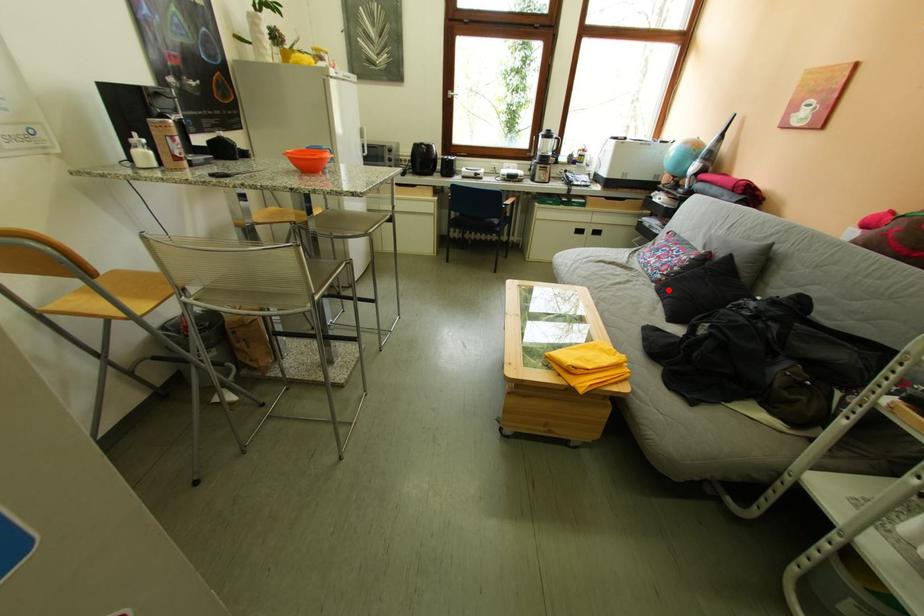
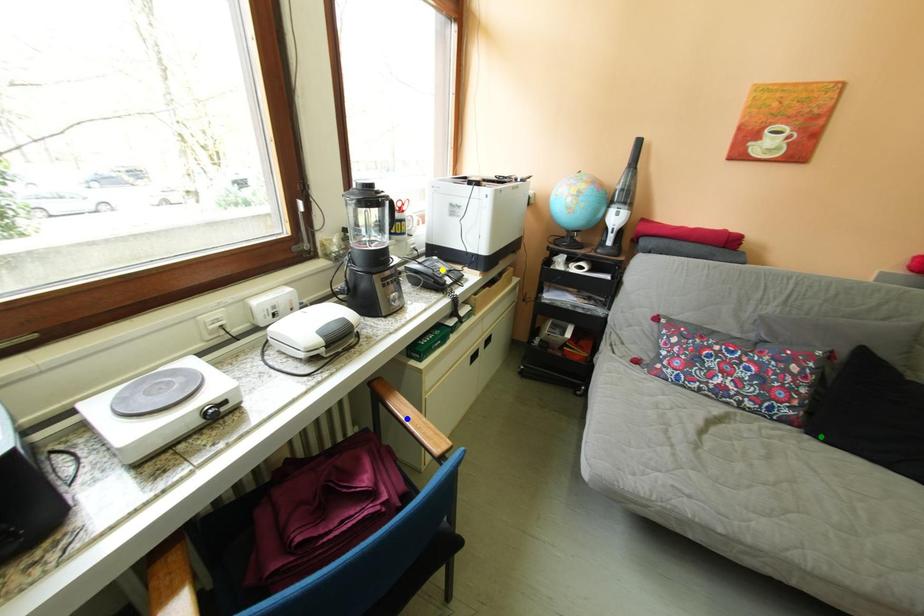
Question: I am providing you with two images of the same scene from different viewpoints. A red point is marked on the first image. You are given multiple points on the second image. Which spot in image 2 lines up with the point in image 1?

Choices:
 (A) green point
 (B) yellow point
 (C) blue point

Answer: (A)